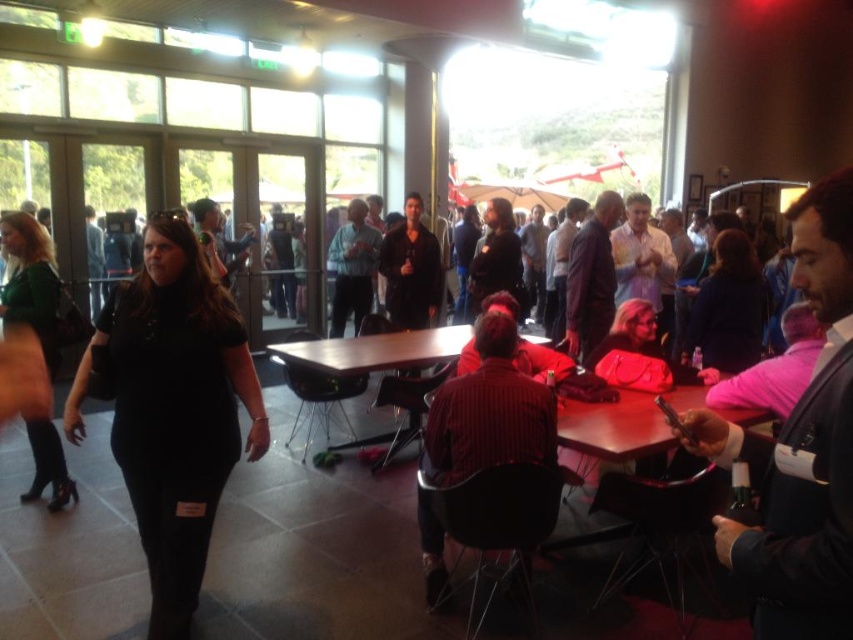
Question: Considering the relative positions of striped shirt at center and wooden table at center in the image provided, where is striped shirt at center located with respect to wooden table at center?

Choices:
 (A) above
 (B) below

Answer: (B)

Question: Does striped shirt at center have a larger size compared to wooden table at center?

Choices:
 (A) yes
 (B) no

Answer: (B)

Question: Considering the real-world distances, which object is farthest from the wooden table at center?

Choices:
 (A) black matte shirt at center
 (B) green fabric dress at left
 (C) striped shirt at center

Answer: (B)

Question: Among these objects, which one is nearest to the camera?

Choices:
 (A) wooden table at center
 (B) black matte shirt at center
 (C) striped shirt at center

Answer: (B)

Question: From the image, what is the correct spatial relationship of green fabric dress at left in relation to wooden table at center?

Choices:
 (A) right
 (B) left

Answer: (B)

Question: Which of the following is the closest to the observer?

Choices:
 (A) (41, 273)
 (B) (135, 436)
 (C) (463, 406)
 (D) (467, 332)

Answer: (B)